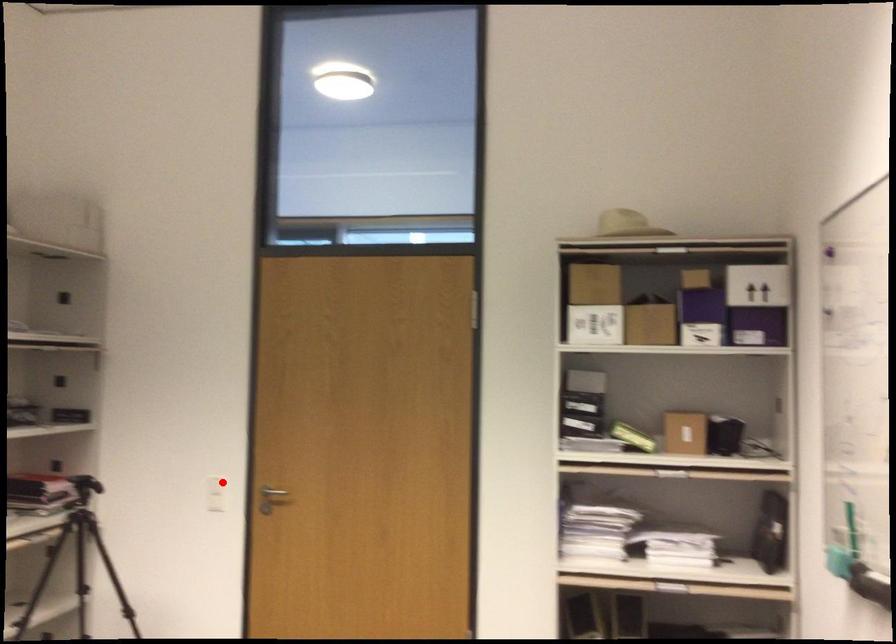
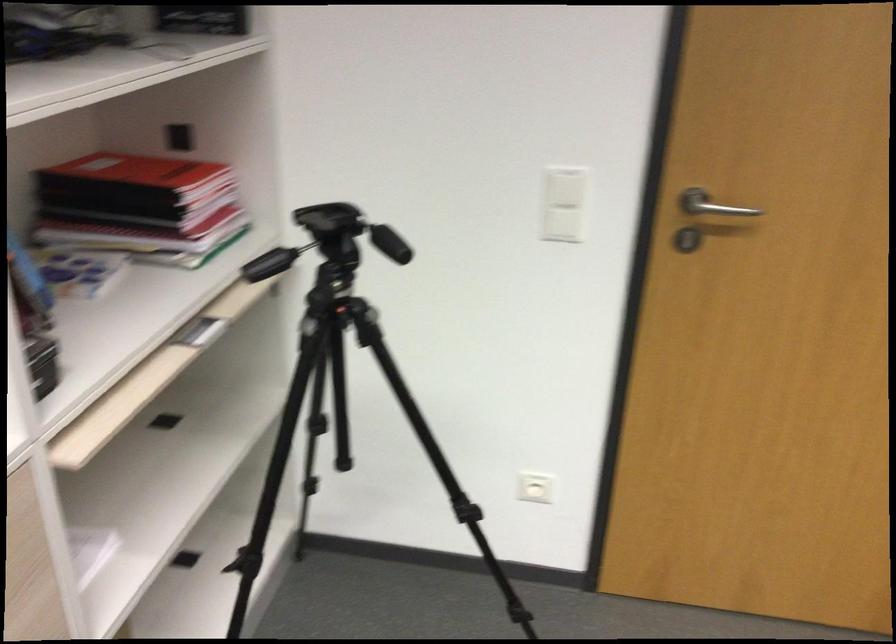
Question: A red point is marked in image1. In image2, is the corresponding 3D point closer to the camera or farther? Reply with the corresponding letter.

Choices:
 (A) The corresponding 3D point is closer.
 (B) The corresponding 3D point is farther.

Answer: (A)